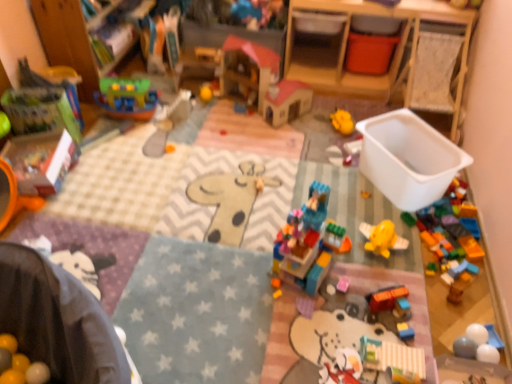
The height and width of the screenshot is (384, 512). In order to click on free space that is in between translucent plastic airplane at center, placed as the fourth toy when sorted from bottom to top, and translucent plastic boat at upper left, the 4th toy viewed from the top in this screenshot , I will do `click(228, 150)`.